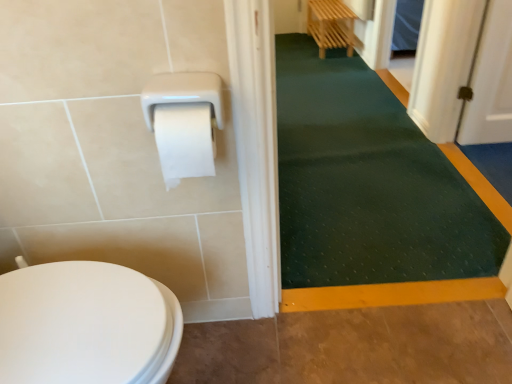
Question: Visually, is brown textured floor at lower right positioned to the left or to the right of dark green rubber bath mat at center?

Choices:
 (A) right
 (B) left

Answer: (B)

Question: From the image's perspective, is brown textured floor at lower right positioned above or below dark green rubber bath mat at center?

Choices:
 (A) above
 (B) below

Answer: (B)

Question: Does point (375, 311) appear closer or farther from the camera than point (404, 130)?

Choices:
 (A) farther
 (B) closer

Answer: (B)

Question: From the image's perspective, relative to brown textured floor at lower right, is dark green rubber bath mat at center above or below?

Choices:
 (A) above
 (B) below

Answer: (A)

Question: Looking at the image, does dark green rubber bath mat at center seem bigger or smaller compared to brown textured floor at lower right?

Choices:
 (A) small
 (B) big

Answer: (B)

Question: Considering the positions of dark green rubber bath mat at center and brown textured floor at lower right in the image, is dark green rubber bath mat at center wider or thinner than brown textured floor at lower right?

Choices:
 (A) thin
 (B) wide

Answer: (B)

Question: Based on their positions, is dark green rubber bath mat at center located to the left or right of brown textured floor at lower right?

Choices:
 (A) right
 (B) left

Answer: (A)